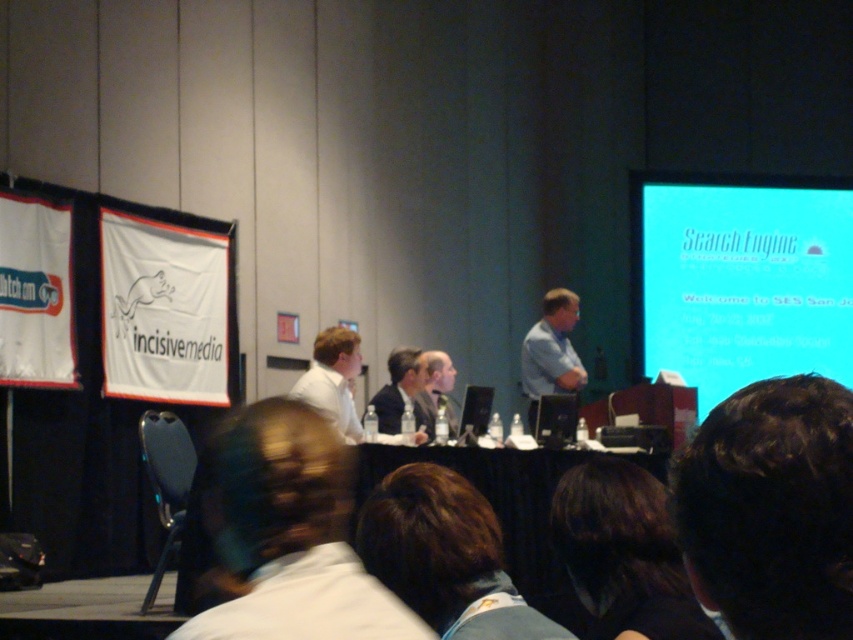
Between dark brown hair at upper right and white shirt at center, which one appears on the left side from the viewer's perspective?

From the viewer's perspective, white shirt at center appears more on the left side.

How much distance is there between dark brown hair at upper right and white shirt at center?

A distance of 4.51 meters exists between dark brown hair at upper right and white shirt at center.

Does point (834, 483) lie in front of point (305, 538)?

Yes, point (834, 483) is in front of point (305, 538).

The height and width of the screenshot is (640, 853). Identify the location of dark brown hair at upper right. pos(770,509).

Looking at this image, does dark brown hair at upper right have a greater height compared to dark suit at center?

No, dark brown hair at upper right is not taller than dark suit at center.

Who is more forward, (737, 557) or (415, 416)?

Point (737, 557) is in front.

Identify the location of dark brown hair at upper right. This screenshot has height=640, width=853. (770, 509).

Can you confirm if white shirt at center is positioned below white matte shirt at center?

Yes, white shirt at center is below white matte shirt at center.

Can you confirm if white shirt at center is thinner than white matte shirt at center?

Yes, white shirt at center is thinner than white matte shirt at center.

Is point (351, 595) positioned before point (357, 432)?

Yes, point (351, 595) is in front of point (357, 432).

The image size is (853, 640). Find the location of `white shirt at center`. white shirt at center is located at coordinates click(282, 536).